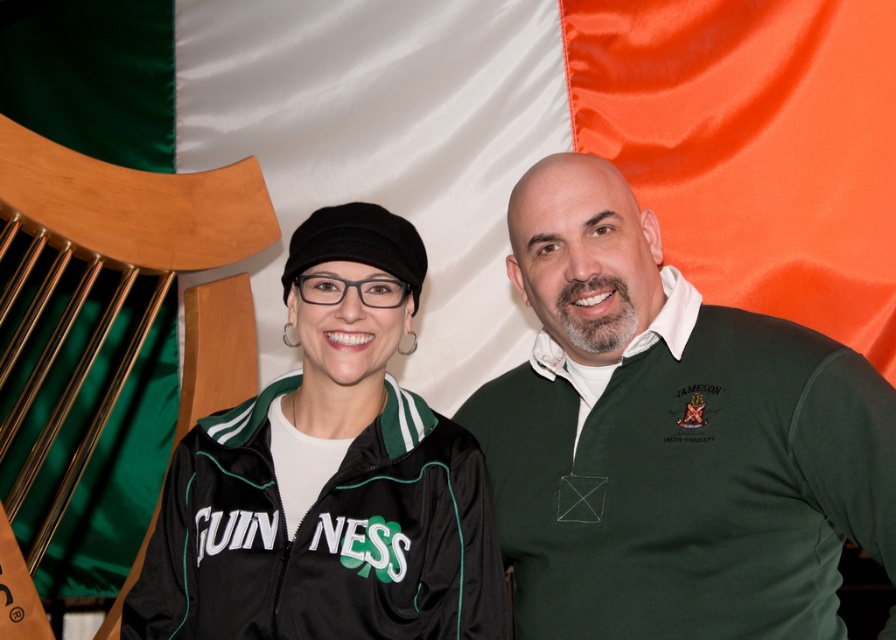
In the scene described, there are two people standing in front of the Irish flag. The person on the left is wearing a black jacket with GUINNESS and a shamrock, and the person on the right is in a dark green sweater. There is a point marked at coordinates (670, 438). Which object from the scene does this point correspond to?

The point at coordinates (670, 438) corresponds to the green jersey at center.

You are a photographer trying to adjust the lighting for a group photo. You notice two items in the scene that are both at the center of the image. Which one is located to the right of the other? The items are the green jersey at center and the black fabric jacket at center.

The green jersey at center is positioned on the right side of the black fabric jacket at center.